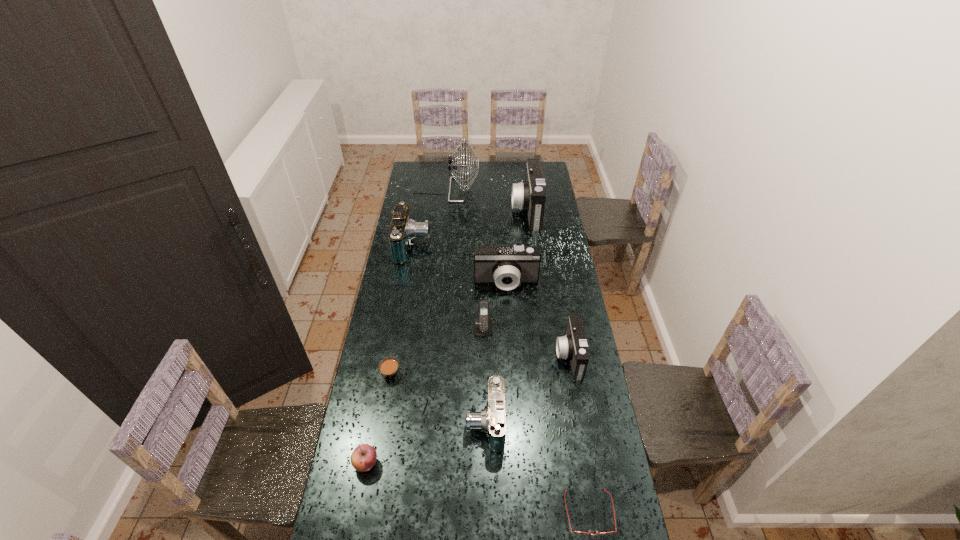
What are the coordinates of `the smaller blue camcorder` in the screenshot? It's located at (492, 420).

Image resolution: width=960 pixels, height=540 pixels. Find the location of `the nearest camcorder`. the nearest camcorder is located at coordinates (492, 420).

Identify the location of the eighth tallest object. (363, 458).

You are a GUI agent. You are given a task and a screenshot of the screen. Output one action in this format:
    pyautogui.click(x=<x>, y=<y>)
    Task: Click on the cappuccino
    
    Given the screenshot: What is the action you would take?
    pyautogui.click(x=390, y=371)

At what (x,y) coordinates should I click in order to perform the action: click on the second shortest object. Please return your answer as a coordinate pair (x, y). Looking at the image, I should click on (390, 371).

This screenshot has width=960, height=540. What are the coordinates of `the shortest object` in the screenshot? It's located at (575, 532).

Locate an element on the screen. The width and height of the screenshot is (960, 540). the nearest object is located at coordinates (575, 532).

I want to click on vacant space located 0.160m on the front-facing side of the fan, so click(x=506, y=190).

Where is `free space located on the lens of the ninth shortest object`? The width and height of the screenshot is (960, 540). free space located on the lens of the ninth shortest object is located at coordinates (466, 210).

Where is `free point located on the lens of the ninth shortest object`? free point located on the lens of the ninth shortest object is located at coordinates (487, 210).